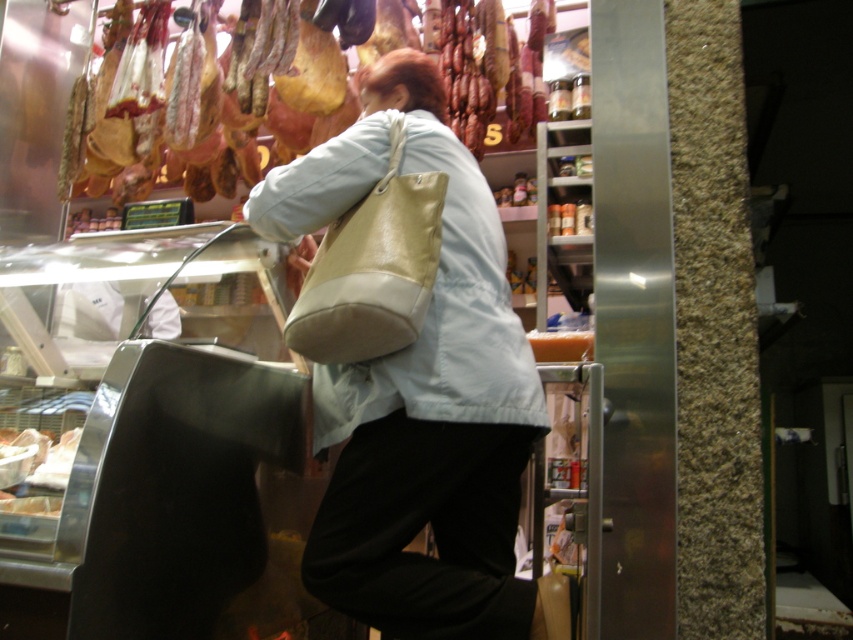
Who is shorter, beige leather bag at center or matte brown cured meat at upper left?

matte brown cured meat at upper left is shorter.

Can you confirm if beige leather bag at center is wider than matte brown cured meat at upper left?

No.

Is point (312, 376) more distant than point (490, 134)?

No, (312, 376) is in front of (490, 134).

The width and height of the screenshot is (853, 640). I want to click on beige leather bag at center, so click(x=418, y=392).

How distant is matte brown cured meat at upper left from white glossy cheese at lower left?

matte brown cured meat at upper left is 4.82 feet from white glossy cheese at lower left.

Who is positioned more to the right, matte brown cured meat at upper left or white glossy cheese at lower left?

white glossy cheese at lower left

Is point (125, 189) more distant than point (65, 449)?

Yes, it is.

Locate an element on the screen. matte brown cured meat at upper left is located at coordinates (99, 173).

Is beige leather bag at center to the right of white glossy cheese at lower left from the viewer's perspective?

Yes, beige leather bag at center is to the right of white glossy cheese at lower left.

Is beige leather bag at center smaller than white glossy cheese at lower left?

No, beige leather bag at center is not smaller than white glossy cheese at lower left.

Is point (483, 362) positioned after point (38, 497)?

Yes, point (483, 362) is behind point (38, 497).

I want to click on beige leather bag at center, so click(418, 392).